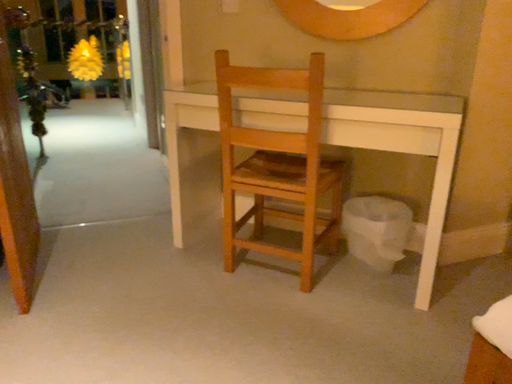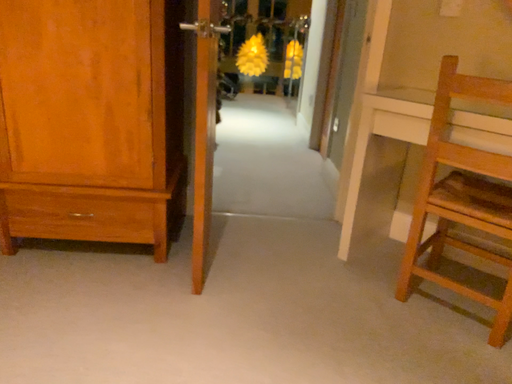
Question: How did the camera likely rotate when shooting the video?

Choices:
 (A) rotated right
 (B) rotated left

Answer: (B)